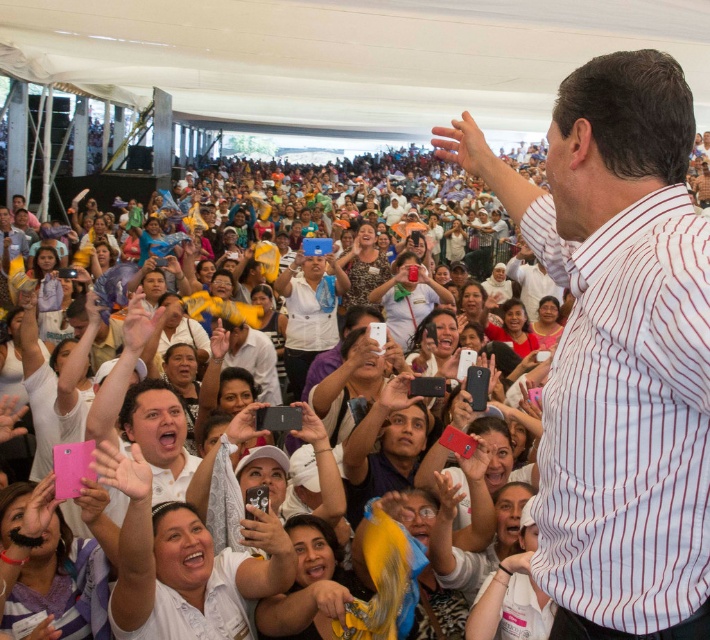
Does white striped shirt at upper right appear over white matte shirt at center?

Result: Actually, white striped shirt at upper right is below white matte shirt at center.

Does white striped shirt at upper right have a greater width compared to white matte shirt at center?

Yes.

Which is in front, point (163, 572) or point (307, 285)?

Point (163, 572) is more forward.

The image size is (710, 640). Find the location of `white striped shirt at upper right`. white striped shirt at upper right is located at coordinates (185, 563).

Is white striped shirt at center closer to camera compared to white striped shirt at upper right?

That is True.

Who is taller, white striped shirt at center or white striped shirt at upper right?

Standing taller between the two is white striped shirt at center.

This screenshot has width=710, height=640. In order to click on white striped shirt at center in this screenshot , I will do `click(618, 349)`.

Is white striped shirt at center above white matte shirt at center?

Yes.

You are a GUI agent. You are given a task and a screenshot of the screen. Output one action in this format:
    pyautogui.click(x=<x>, y=<y>)
    Task: Click on the white striped shirt at center
    The image size is (710, 640).
    Given the screenshot: What is the action you would take?
    pyautogui.click(x=618, y=349)

You are a GUI agent. You are given a task and a screenshot of the screen. Output one action in this format:
    pyautogui.click(x=<x>, y=<y>)
    Task: Click on the white striped shirt at center
    
    Given the screenshot: What is the action you would take?
    pyautogui.click(x=618, y=349)